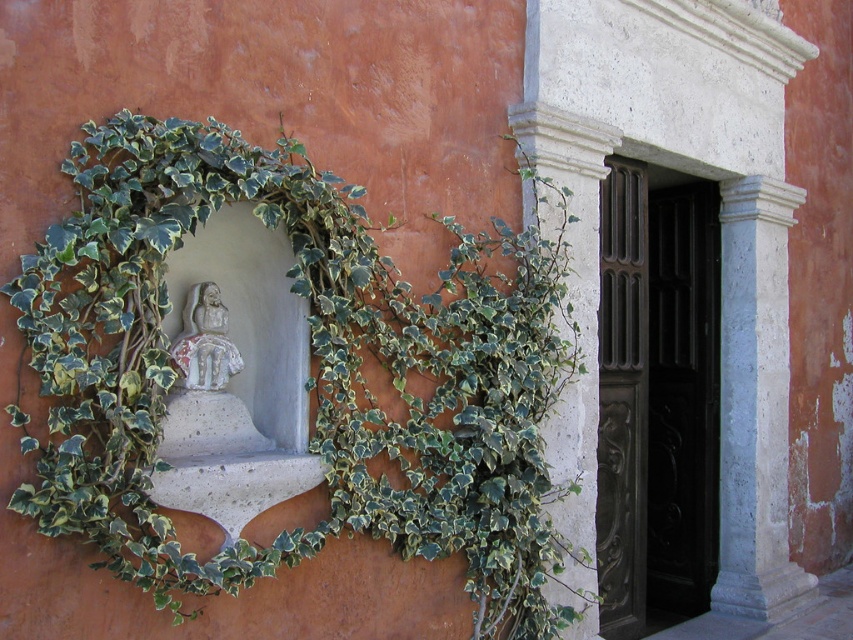
Question: Does green leafy ivy at left lie behind white stone pillar at right?

Choices:
 (A) no
 (B) yes

Answer: (A)

Question: Which point is closer to the camera?

Choices:
 (A) (228, 157)
 (B) (780, 99)

Answer: (A)

Question: Can you confirm if green leafy ivy at left is thinner than white stone pillar at right?

Choices:
 (A) yes
 (B) no

Answer: (A)

Question: Which point is closer to the camera?

Choices:
 (A) green leafy ivy at left
 (B) white stone pillar at right

Answer: (A)

Question: Is green leafy ivy at left further to the viewer compared to white stone pillar at right?

Choices:
 (A) no
 (B) yes

Answer: (A)